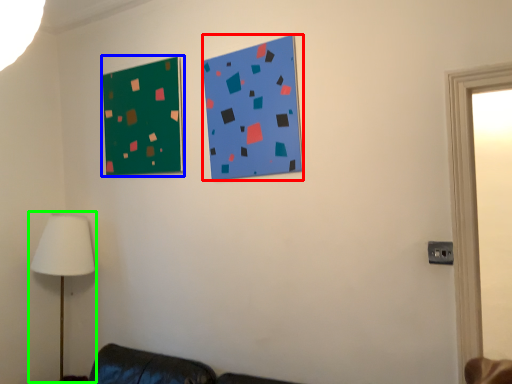
Question: Based on their relative distances, which object is farther from bulletin board (highlighted by a red box)? Choose from bulletin board (highlighted by a blue box) and table lamp (highlighted by a green box).

Choices:
 (A) bulletin board
 (B) table lamp

Answer: (B)